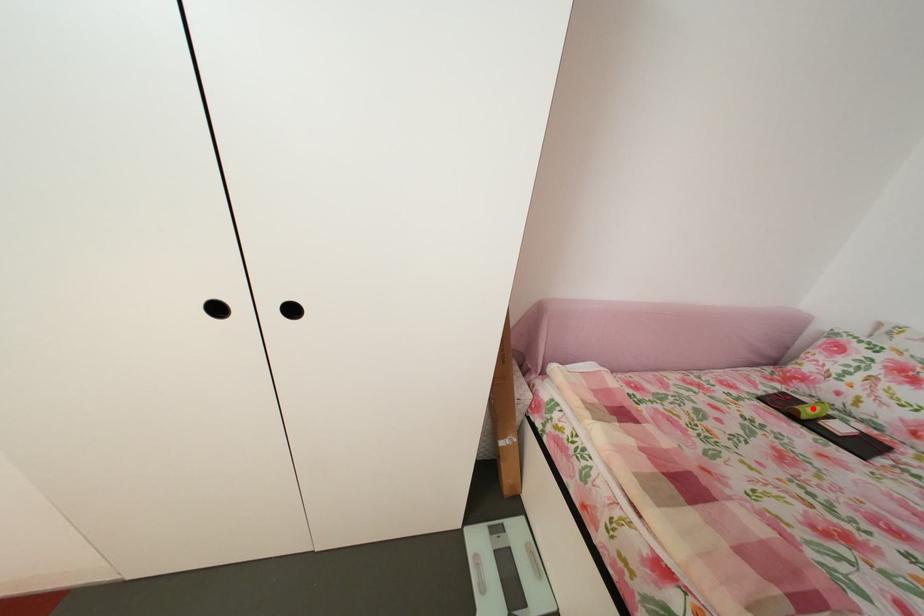
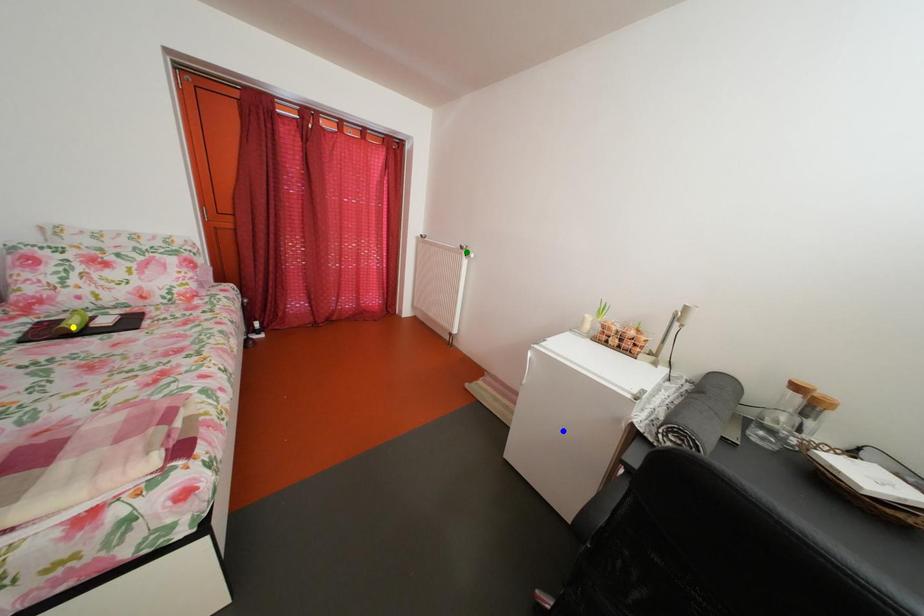
Question: I am providing you with two images of the same scene from different viewpoints. A red point is marked on the first image. You are given multiple points on the second image. Which spot in image 2 lines up with the point in image 1?

Choices:
 (A) green point
 (B) yellow point
 (C) blue point

Answer: (B)